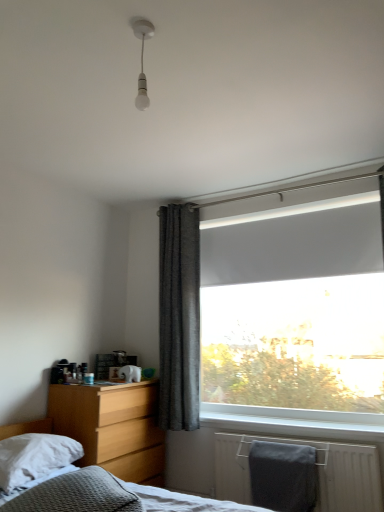
Question: From a real-world perspective, is light wood/finish nightstand at lower left under dark grey textured curtain at center?

Choices:
 (A) yes
 (B) no

Answer: (A)

Question: From a real-world perspective, is light wood/finish nightstand at lower left physically above dark grey textured curtain at center?

Choices:
 (A) no
 (B) yes

Answer: (A)

Question: Is there a large distance between light wood/finish nightstand at lower left and dark grey textured curtain at center?

Choices:
 (A) yes
 (B) no

Answer: (B)

Question: Is light wood/finish nightstand at lower left with dark grey textured curtain at center?

Choices:
 (A) yes
 (B) no

Answer: (B)

Question: Considering the relative sizes of light wood/finish nightstand at lower left and dark grey textured curtain at center in the image provided, is light wood/finish nightstand at lower left smaller than dark grey textured curtain at center?

Choices:
 (A) yes
 (B) no

Answer: (B)

Question: From a real-world perspective, is light wood/finish nightstand at lower left physically located above or below gray matte towel at lower right?

Choices:
 (A) above
 (B) below

Answer: (A)

Question: Considering their positions, is light wood/finish nightstand at lower left located in front of or behind gray matte towel at lower right?

Choices:
 (A) behind
 (B) front

Answer: (A)

Question: In terms of size, does light wood/finish nightstand at lower left appear bigger or smaller than gray matte towel at lower right?

Choices:
 (A) small
 (B) big

Answer: (B)

Question: Would you say light wood/finish nightstand at lower left is inside or outside gray matte towel at lower right?

Choices:
 (A) inside
 (B) outside

Answer: (B)

Question: Which is correct: white matte window screen at upper right is inside white glossy bulb at upper center, or outside of it?

Choices:
 (A) outside
 (B) inside

Answer: (A)

Question: Looking at the image, does white matte window screen at upper right seem bigger or smaller compared to white glossy bulb at upper center?

Choices:
 (A) big
 (B) small

Answer: (A)

Question: Is white matte window screen at upper right in front of or behind white glossy bulb at upper center in the image?

Choices:
 (A) behind
 (B) front

Answer: (A)

Question: From a real-world perspective, is white matte window screen at upper right above or below white glossy bulb at upper center?

Choices:
 (A) below
 (B) above

Answer: (A)

Question: In the image, is textured gray bed at lower left positioned in front of or behind gray matte towel at lower right?

Choices:
 (A) front
 (B) behind

Answer: (A)

Question: From the image's perspective, is textured gray bed at lower left located above or below gray matte towel at lower right?

Choices:
 (A) below
 (B) above

Answer: (B)